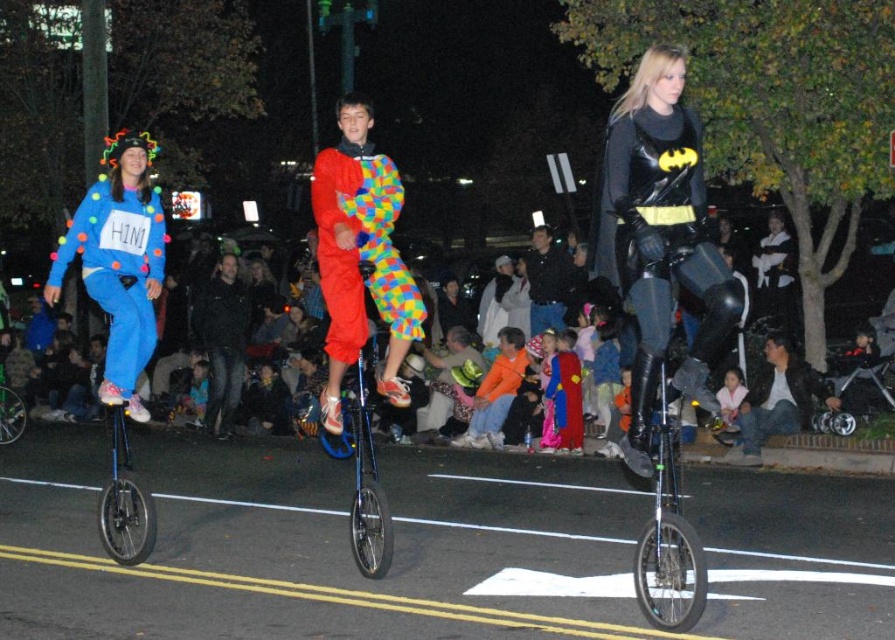
Question: Which of the following is the farthest from the observer?

Choices:
 (A) matte blue jumpsuit at left
 (B) black leather batman costume at center
 (C) black leather jacket at center
 (D) dark blue shirt at center

Answer: (D)

Question: Is matte blue jumpsuit at left bigger than blue metallic unicycle at center?

Choices:
 (A) no
 (B) yes

Answer: (A)

Question: Is black leather batman costume at center thinner than blue metallic unicycle at center?

Choices:
 (A) yes
 (B) no

Answer: (A)

Question: Which object is the closest to the black leather batman costume at center?

Choices:
 (A) matte blue jumpsuit at left
 (B) blue metallic unicycle at center

Answer: (B)

Question: Observing the image, what is the correct spatial positioning of black leather jacket at center in reference to dark blue shirt at center?

Choices:
 (A) right
 (B) left

Answer: (B)

Question: Which point is closer to the camera?

Choices:
 (A) (236, 268)
 (B) (142, 140)
 (C) (347, 342)

Answer: (C)